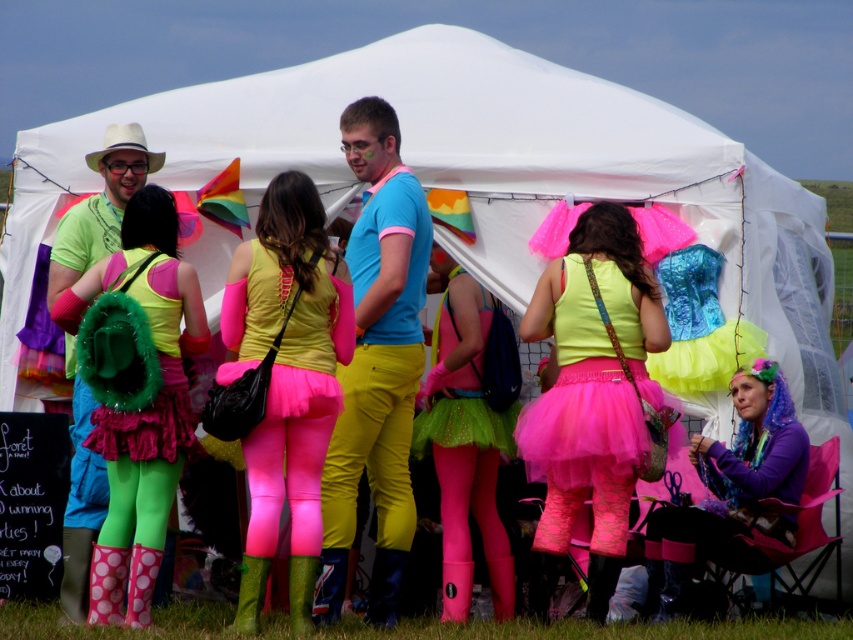
You are a photographer standing at the center of the tent. You want to take a photo that includes both the matte yellow tank top at center and the white fabric cowboy hat at upper left. Given that your camera has a maximum focus range of 3 meters, will both subjects be in focus?

The matte yellow tank top at center is 3.19 meters away from the white fabric cowboy hat at upper left. Since the camera can only focus up to 3 meters, the distance between them exceeds the focus range, so both subjects cannot be in focus simultaneously.

You are standing at the center of the image. Which direction should you look to see the fuzzy green backpack at left?

You should look to the left to see the fuzzy green backpack at left since it is located at the left side of the image.

You are standing at the entrance of the canopy tent and want to locate the matte yellow tank top at center. According to the coordinates provided, where would you look to find it?

The matte yellow tank top at center is located at the coordinates point (286,381), which would be slightly to the right and lower center area of the image.